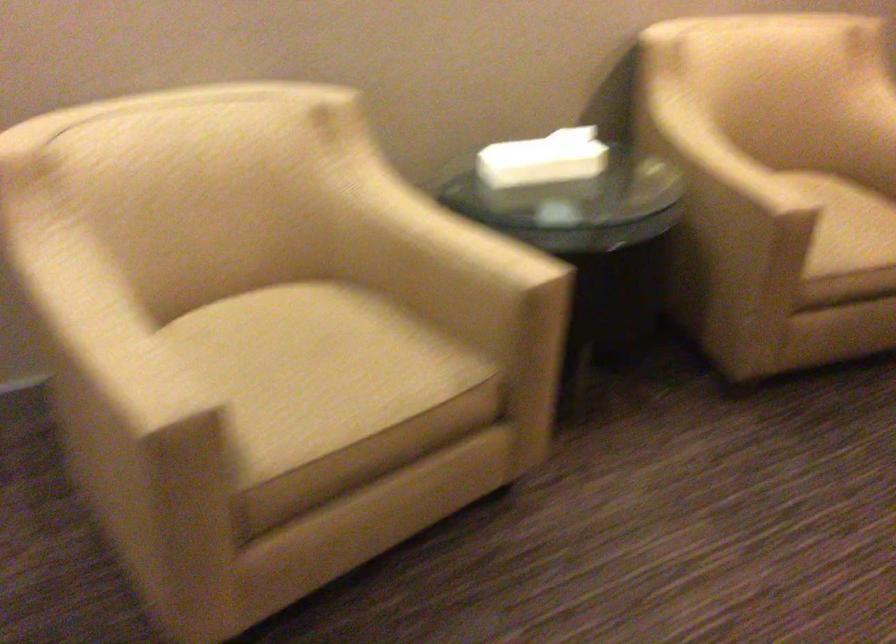
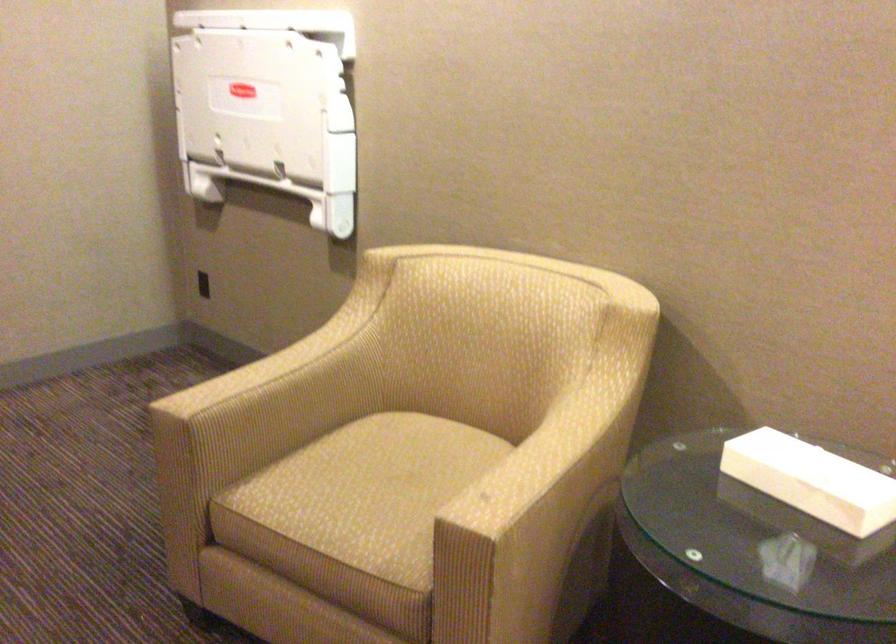
In the second image, find the point that corresponds to pixel 407 213 in the first image.

(565, 426)